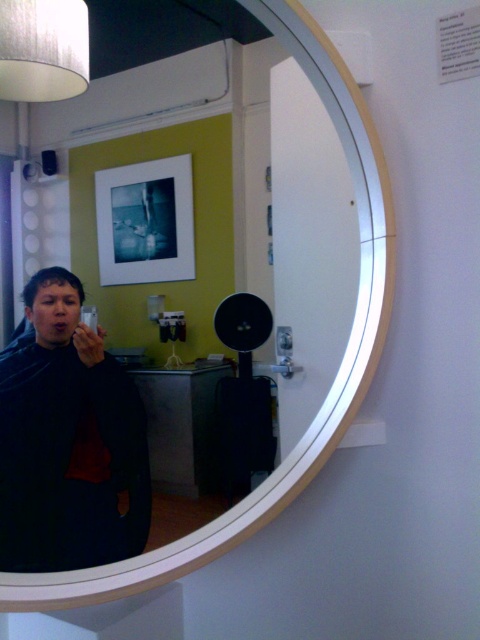
In the scene shown: You are looking at the mirror in the image. There are two points marked in the reflection, point [128,420] and point [238,310]. Which of these two points is closer to you as you look at the mirror?

Point [128,420] is closer to the camera than point [238,310].

You are standing in front of the mirror and notice two matte black objects reflected in it. The objects are the matte black shirt at left and the matte black speaker at center. Which object appears wider in the reflection?

The matte black shirt at left appears wider in the reflection since its width is larger than that of the matte black speaker at center.